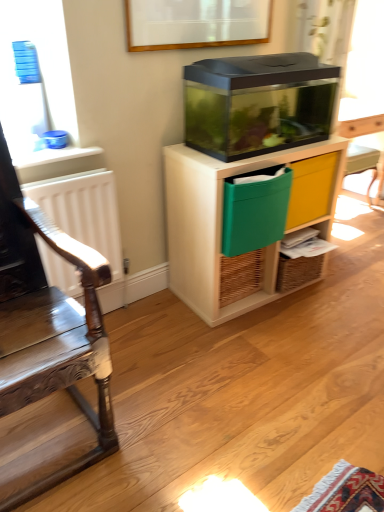
Question: Is transparent plastic cabinet at center positioned before white matte radiator at left?

Choices:
 (A) yes
 (B) no

Answer: (B)

Question: Considering the relative sizes of transparent plastic cabinet at center and white matte radiator at left in the image provided, is transparent plastic cabinet at center taller than white matte radiator at left?

Choices:
 (A) no
 (B) yes

Answer: (B)

Question: Considering the relative sizes of transparent plastic cabinet at center and white matte radiator at left in the image provided, is transparent plastic cabinet at center wider than white matte radiator at left?

Choices:
 (A) no
 (B) yes

Answer: (B)

Question: Is transparent plastic cabinet at center far from white matte radiator at left?

Choices:
 (A) no
 (B) yes

Answer: (A)

Question: Is transparent plastic cabinet at center thinner than white matte radiator at left?

Choices:
 (A) no
 (B) yes

Answer: (A)

Question: Is green fabric crate at center bigger or smaller than wooden polished chair at left?

Choices:
 (A) small
 (B) big

Answer: (A)

Question: In terms of height, does green fabric crate at center look taller or shorter compared to wooden polished chair at left?

Choices:
 (A) tall
 (B) short

Answer: (B)

Question: In terms of width, does green fabric crate at center look wider or thinner when compared to wooden polished chair at left?

Choices:
 (A) thin
 (B) wide

Answer: (A)

Question: Based on their positions, is green fabric crate at center located to the left or right of wooden polished chair at left?

Choices:
 (A) right
 (B) left

Answer: (A)

Question: Considering the positions of point (274, 279) and point (112, 446), is point (274, 279) closer or farther from the camera than point (112, 446)?

Choices:
 (A) closer
 (B) farther

Answer: (B)

Question: From the image's perspective, is transparent plastic cabinet at center positioned above or below wooden polished chair at left?

Choices:
 (A) below
 (B) above

Answer: (B)

Question: In terms of height, does transparent plastic cabinet at center look taller or shorter compared to wooden polished chair at left?

Choices:
 (A) tall
 (B) short

Answer: (B)

Question: Considering the relative positions of transparent plastic cabinet at center and wooden polished chair at left in the image provided, is transparent plastic cabinet at center to the left or to the right of wooden polished chair at left?

Choices:
 (A) left
 (B) right

Answer: (B)

Question: Does point (1, 394) appear closer or farther from the camera than point (311, 160)?

Choices:
 (A) farther
 (B) closer

Answer: (B)

Question: Is wooden polished chair at left inside the boundaries of green fabric drawer at center-right, or outside?

Choices:
 (A) outside
 (B) inside

Answer: (A)